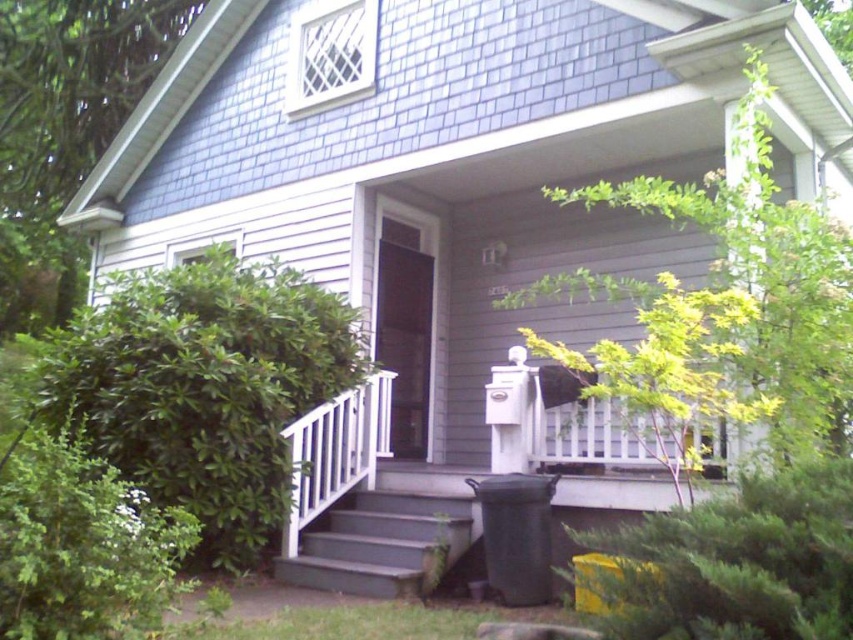
Does smooth gray stairs at lower center appear over white plastic rail at lower center?

Actually, smooth gray stairs at lower center is below white plastic rail at lower center.

What do you see at coordinates (381, 545) in the screenshot? I see `smooth gray stairs at lower center` at bounding box center [381, 545].

Does point (444, 509) come behind point (306, 493)?

No, it is not.

This screenshot has width=853, height=640. Identify the location of smooth gray stairs at lower center. (381, 545).

Can you confirm if green leafy bush at left is wider than white plastic rail at lower center?

Correct, the width of green leafy bush at left exceeds that of white plastic rail at lower center.

Does point (228, 268) lie behind point (349, 390)?

Yes, it is behind point (349, 390).

Where is `green leafy bush at left`? The width and height of the screenshot is (853, 640). green leafy bush at left is located at coordinates (206, 388).

Is green leafy bush at lower left thinner than smooth gray stairs at lower center?

Indeed, green leafy bush at lower left has a lesser width compared to smooth gray stairs at lower center.

Who is positioned more to the right, green leafy bush at lower left or smooth gray stairs at lower center?

Positioned to the right is smooth gray stairs at lower center.

Describe the element at coordinates (83, 545) in the screenshot. I see `green leafy bush at lower left` at that location.

Image resolution: width=853 pixels, height=640 pixels. Identify the location of green leafy bush at lower left. (83, 545).